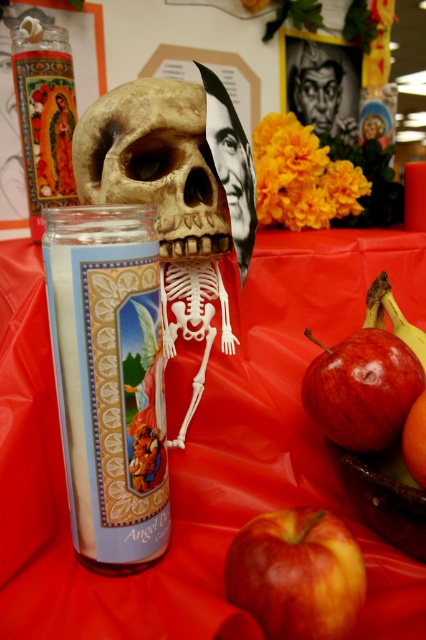
Can you confirm if matte plastic skeleton at center is thinner than shiny red apple at lower center?

Incorrect, matte plastic skeleton at center's width is not less than shiny red apple at lower center's.

Which is more to the left, matte plastic skeleton at center or shiny red apple at lower center?

matte plastic skeleton at center

You are a GUI agent. You are given a task and a screenshot of the screen. Output one action in this format:
    pyautogui.click(x=<x>, y=<y>)
    Task: Click on the matte plastic skeleton at center
    
    Given the screenshot: What is the action you would take?
    pyautogui.click(x=201, y=451)

This screenshot has width=426, height=640. Find the location of `matte plastic skeleton at center`. matte plastic skeleton at center is located at coordinates (201, 451).

Can you confirm if matte plastic skeleton at center is positioned to the left of white wax candle at center?

No, matte plastic skeleton at center is not to the left of white wax candle at center.

At what (x,y) coordinates should I click in order to perform the action: click on matte plastic skeleton at center. Please return your answer as a coordinate pair (x, y). The width and height of the screenshot is (426, 640). Looking at the image, I should click on (201, 451).

Can you confirm if matte plastic skeleton at center is taller than orange matte at lower right?

Indeed, matte plastic skeleton at center has a greater height compared to orange matte at lower right.

Does matte plastic skeleton at center lie in front of orange matte at lower right?

Yes, it is in front of orange matte at lower right.

Where is `matte plastic skeleton at center`? The image size is (426, 640). matte plastic skeleton at center is located at coordinates (201, 451).